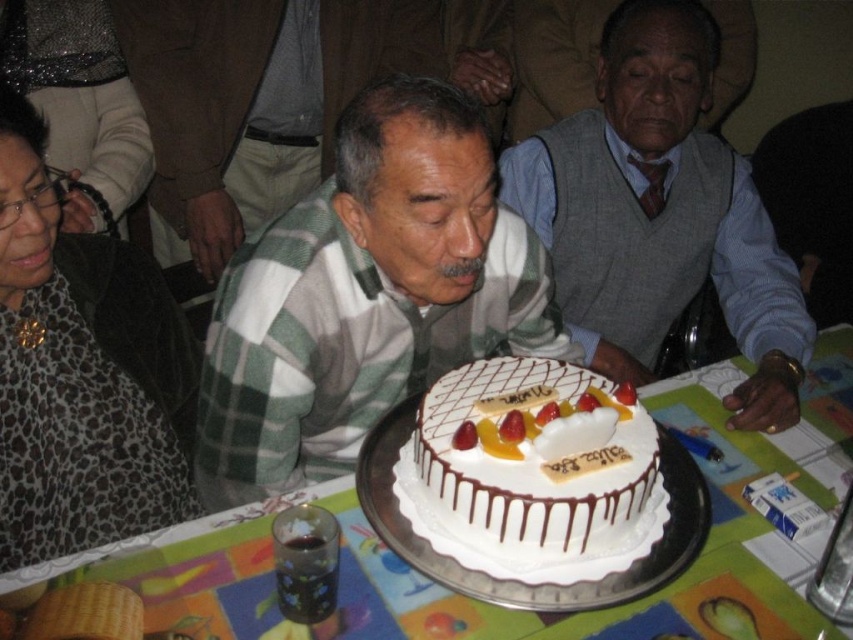
Question: Among these objects, which one is farthest from the camera?

Choices:
 (A) white paper table at center
 (B) leopard print scarf at upper left
 (C) white textured sweater at center
 (D) white frosted cake at center

Answer: (C)

Question: Is the position of white matte sweater at center less distant than that of leopard print scarf at upper left?

Choices:
 (A) yes
 (B) no

Answer: (A)

Question: From the image, what is the correct spatial relationship of gray sweater vest at center in relation to white paper table at center?

Choices:
 (A) right
 (B) left

Answer: (A)

Question: Does white matte sweater at center have a larger size compared to white frosted cake at center?

Choices:
 (A) no
 (B) yes

Answer: (B)

Question: Estimate the real-world distances between objects in this image. Which object is closer to the gray sweater vest at center?

Choices:
 (A) leopard print scarf at upper left
 (B) white matte sweater at center

Answer: (B)

Question: Among these objects, which one is farthest from the camera?

Choices:
 (A) white matte sweater at center
 (B) white textured sweater at center
 (C) white frosted cake at center
 (D) leopard print scarf at upper left

Answer: (B)